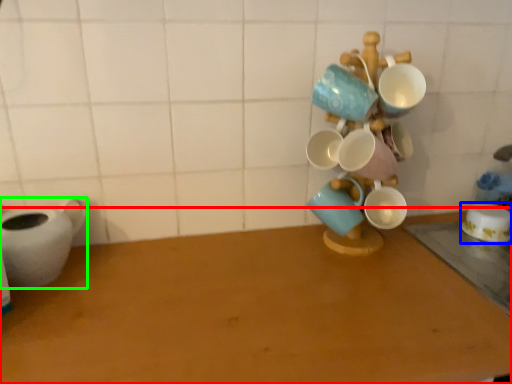
Question: Which is nearer to the table (highlighted by a red box)? coffee cup (highlighted by a blue box) or tableware (highlighted by a green box).

Choices:
 (A) coffee cup
 (B) tableware

Answer: (B)